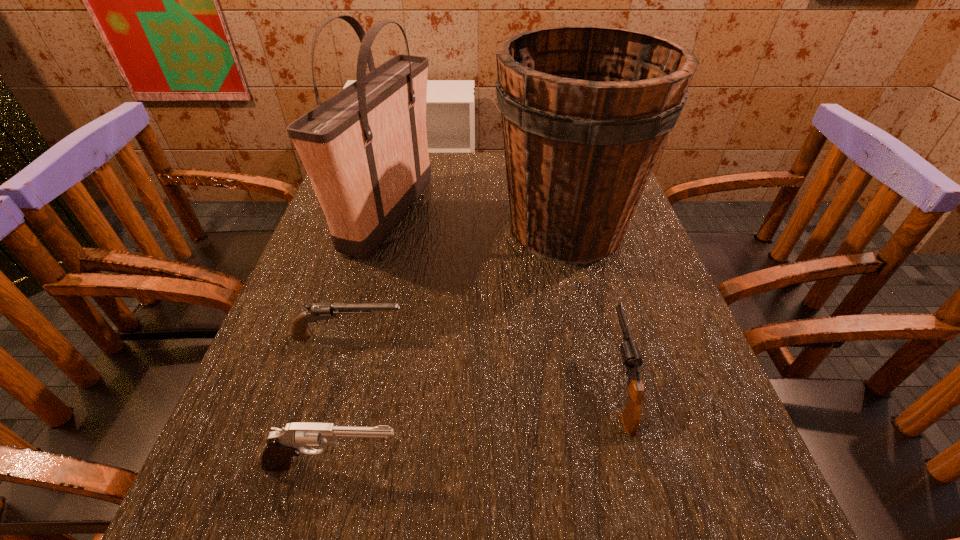
Locate an element on the screen. The width and height of the screenshot is (960, 540). free region located along the barrel of the second farthest gun is located at coordinates (584, 255).

You are a GUI agent. You are given a task and a screenshot of the screen. Output one action in this format:
    pyautogui.click(x=<x>, y=<y>)
    Task: Click on the free space located 0.290m along the barrel of the second farthest gun
    This screenshot has height=540, width=960.
    Given the screenshot: What is the action you would take?
    pyautogui.click(x=582, y=247)

Image resolution: width=960 pixels, height=540 pixels. What are the coordinates of `vacant space located along the barrel of the second farthest gun` in the screenshot? It's located at (588, 267).

The height and width of the screenshot is (540, 960). I want to click on vacant area situated aiming along the barrel of the third nearest object, so click(x=441, y=336).

I want to click on shopping bag present at the far edge, so click(x=365, y=149).

At what (x,y) coordinates should I click in order to perform the action: click on bucket that is positioned at the far edge. Please return your answer as a coordinate pair (x, y). Image resolution: width=960 pixels, height=540 pixels. Looking at the image, I should click on (586, 110).

Locate an element on the screen. Image resolution: width=960 pixels, height=540 pixels. shopping bag at the left edge is located at coordinates (365, 149).

I want to click on bucket that is positioned at the right edge, so click(x=586, y=110).

The image size is (960, 540). I want to click on gun that is positioned at the right edge, so click(x=631, y=416).

Locate an element on the screen. The height and width of the screenshot is (540, 960). object that is at the far left corner is located at coordinates (365, 149).